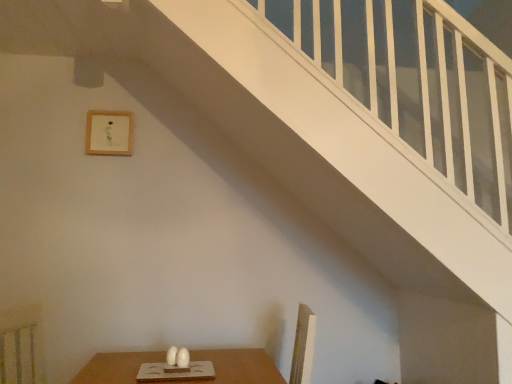
Describe the element at coordinates (109, 133) in the screenshot. The image size is (512, 384). I see `wooden frame at upper center` at that location.

Locate an element on the screen. The width and height of the screenshot is (512, 384). wooden frame at upper center is located at coordinates (109, 133).

Image resolution: width=512 pixels, height=384 pixels. Find the location of `wooden frame at upper center`. wooden frame at upper center is located at coordinates (109, 133).